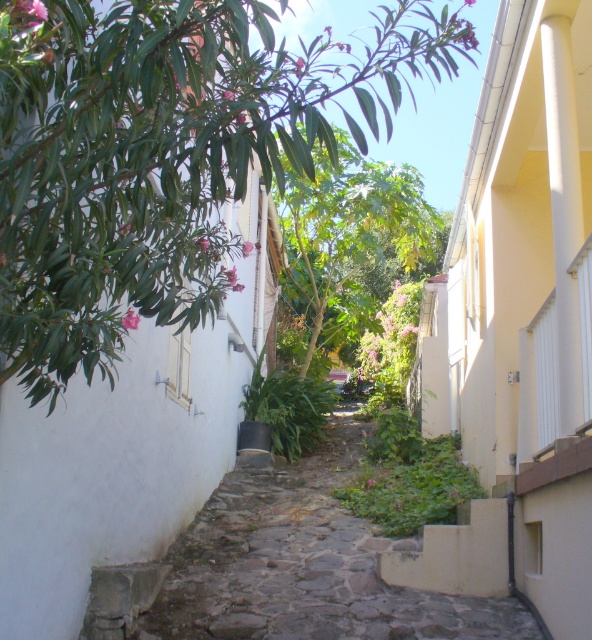
You are standing in the alleyway and want to take a photo of both the green leafy tree at upper left and the green leafy tree at center. Which tree should you focus on first to ensure both are in the frame?

You should focus on the green leafy tree at upper left first because it is closer to you than the green leafy tree at center, so adjusting the camera to include both would require framing starting from the closer one.

You are a delivery person carrying a box and need to walk through the stone cobblestone path at center. The green leafy tree at center is blocking your way. Can you walk under the tree without hitting your head?

The stone cobblestone path at center is shorter than the green leafy tree at center, so yes, you can walk under the tree without hitting your head since the path is shorter than the tree.

You are a delivery person trying to navigate through this narrow alleyway. You need to deliver a package to the address located near the green leafy tree at upper left. As you walk along the stone cobblestone path at center, which direction should you turn to reach the tree?

The green leafy tree at upper left is to the right of the stone cobblestone path at center, so you should turn right to reach the tree.